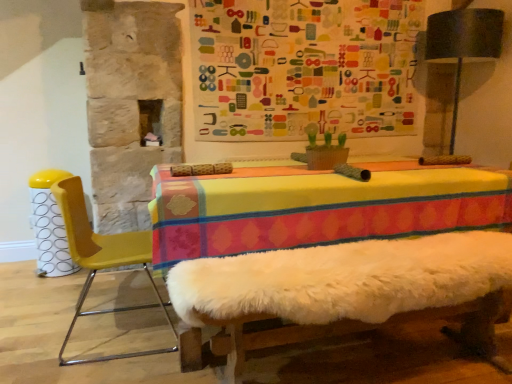
I want to click on free region under yellow plastic chair at left (from a real-world perspective), so click(118, 333).